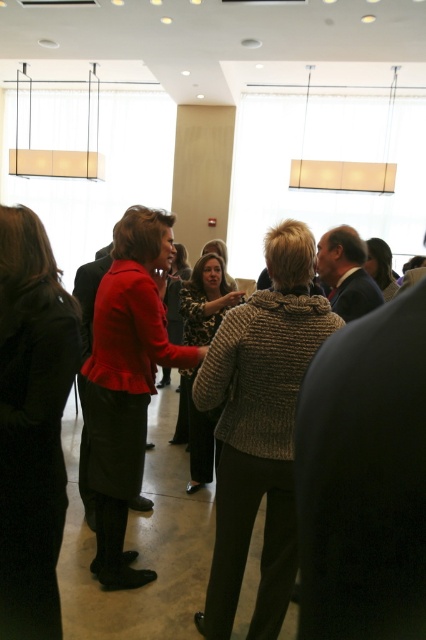
You are at the entrance of the room and want to pick up the black wool coat at left. Which direction should you move to reach it?

The black wool coat at left is located at point 0.664 on the x axis and 0.075 on the y axis. Since you are at the entrance, you should move towards the left side of the room to reach the black wool coat at left.

You are standing at the entrance of the room and want to approach the person wearing the matte red blazer at center. According to the coordinates provided, in which direction should you move from your current position to reach them?

The matte red blazer at center is located at coordinates point (x=126, y=381). Since you are at the entrance, you should move towards the center of the room to reach them.